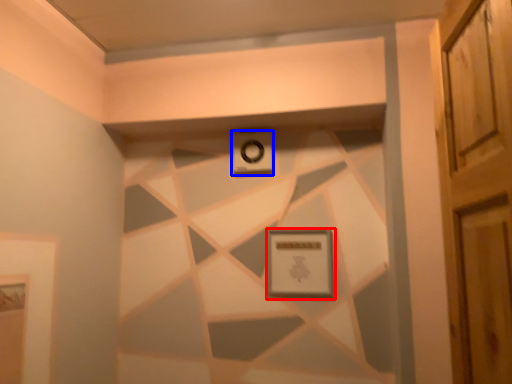
Question: Which object appears farthest to the camera in this image, picture frame (highlighted by a red box) or alarm (highlighted by a blue box)?

Choices:
 (A) picture frame
 (B) alarm

Answer: (B)